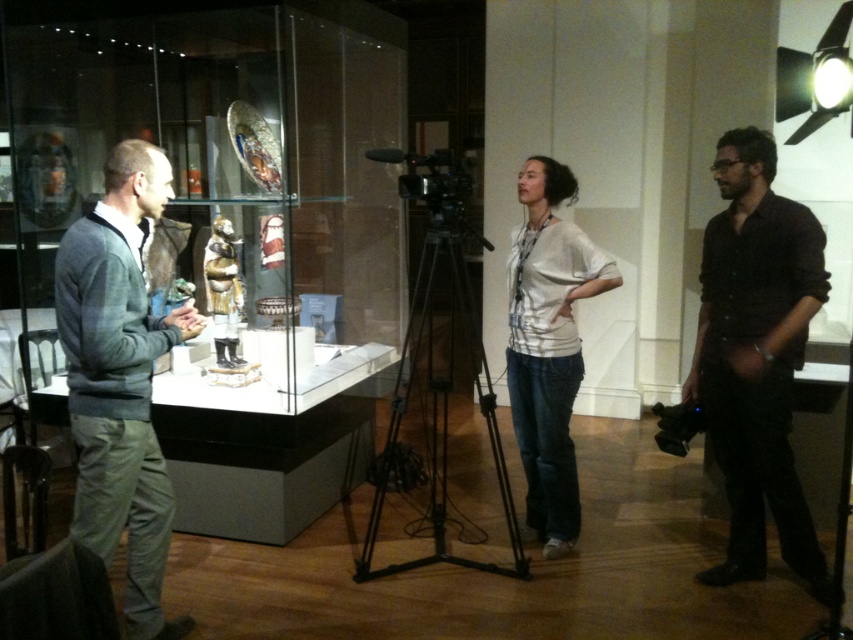
You are a photographer at the museum who needs to take a photo of the display case. You have a black metal tripod at center and a black matte shirt at right in your view. Which object is blocking your view of the display case?

The black matte shirt at right is in front of the black metal tripod at center, so the black matte shirt at right is blocking the view of the display case.

You are a visitor at the museum and want to take a photo of the transparent glass box at center and the white cotton shirt at center. Which object should you focus on first if you want to capture both in a single frame without moving your camera?

The transparent glass box at center is larger in size than the white cotton shirt at center, so you should focus on the transparent glass box at center first to ensure it fits properly in the frame before adjusting for the smaller white cotton shirt at center.